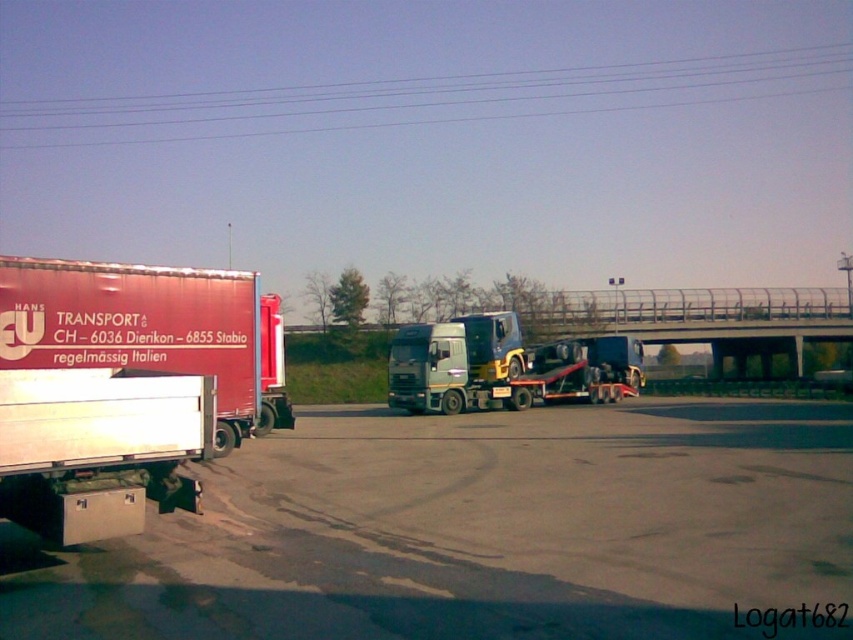
How distant is matte red trailer at left from metallic wires at upper center?

The distance of matte red trailer at left from metallic wires at upper center is 144.96 meters.

Is matte red trailer at left bigger than metallic wires at upper center?

No.

Is point (26, 362) farther from camera compared to point (9, 129)?

No, it is in front of (9, 129).

Find the location of a particular element. matte red trailer at left is located at coordinates (126, 387).

Does matte red trailer at left appear under metallic silver truck at center?

Incorrect, matte red trailer at left is not positioned below metallic silver truck at center.

Image resolution: width=853 pixels, height=640 pixels. Find the location of `matte red trailer at left`. matte red trailer at left is located at coordinates (126, 387).

Identify the location of matte red trailer at left. The height and width of the screenshot is (640, 853). (126, 387).

What are the coordinates of `matte red trailer at left` in the screenshot? It's located at (126, 387).

In the scene shown: Does gray asphalt tarmac at lower center have a lesser height compared to metallic silver truck at center?

Yes, gray asphalt tarmac at lower center is shorter than metallic silver truck at center.

Looking at this image, can you confirm if gray asphalt tarmac at lower center is smaller than metallic silver truck at center?

Indeed, gray asphalt tarmac at lower center has a smaller size compared to metallic silver truck at center.

You are a GUI agent. You are given a task and a screenshot of the screen. Output one action in this format:
    pyautogui.click(x=<x>, y=<y>)
    Task: Click on the gray asphalt tarmac at lower center
    Image resolution: width=853 pixels, height=640 pixels.
    Given the screenshot: What is the action you would take?
    pyautogui.click(x=479, y=531)

You are a GUI agent. You are given a task and a screenshot of the screen. Output one action in this format:
    pyautogui.click(x=<x>, y=<y>)
    Task: Click on the gray asphalt tarmac at lower center
    This screenshot has width=853, height=640.
    Given the screenshot: What is the action you would take?
    pyautogui.click(x=479, y=531)